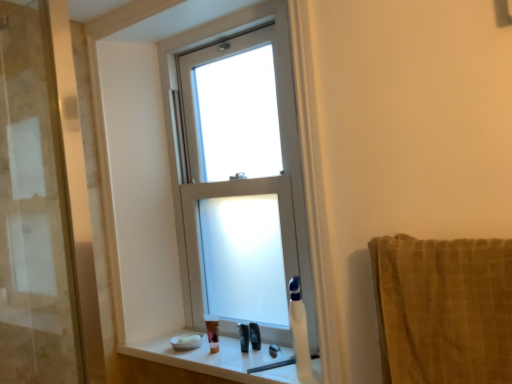
Find the location of a particular element. vacant point above white glossy window sill at lower center (from a real-world perspective) is located at coordinates (236, 356).